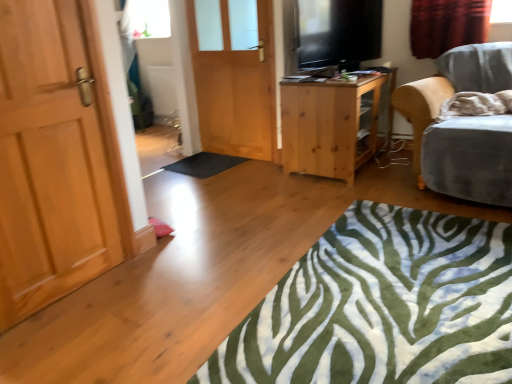
Find the location of a particular element. The width and height of the screenshot is (512, 384). free space between light brown wooden door at left, the second door positioned from the back, and light brown wooden table at center is located at coordinates (238, 218).